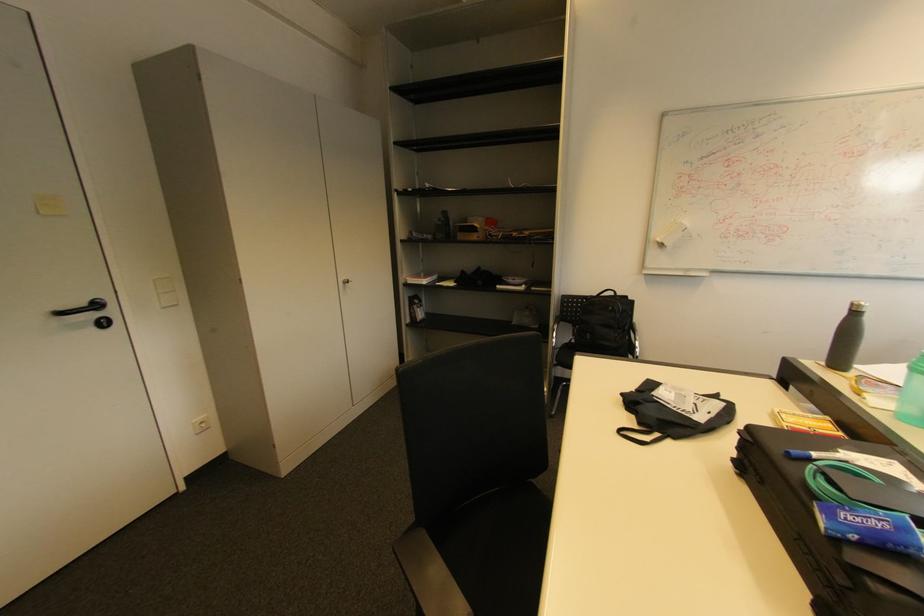
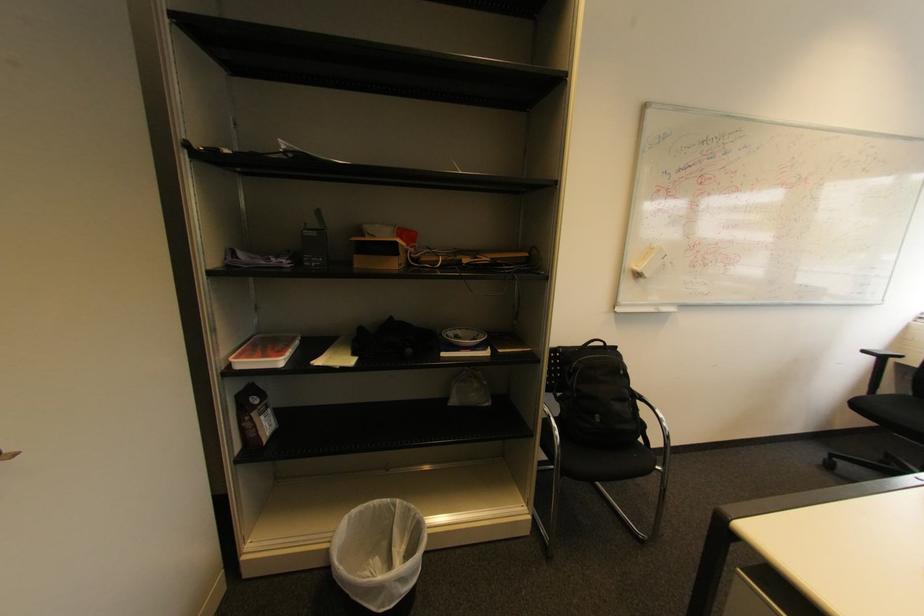
Find the pixel in the second image that matches (x=521, y=278) in the first image.

(464, 333)